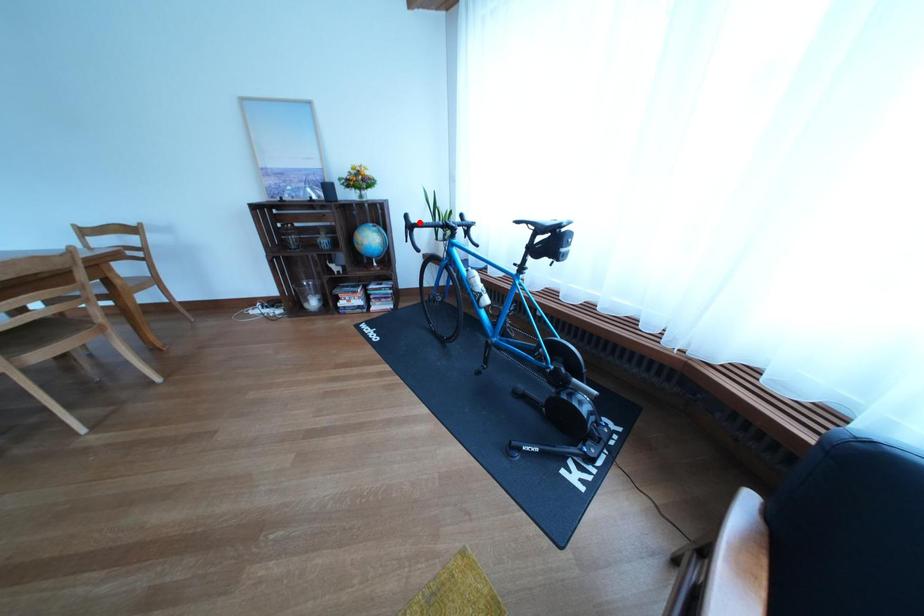
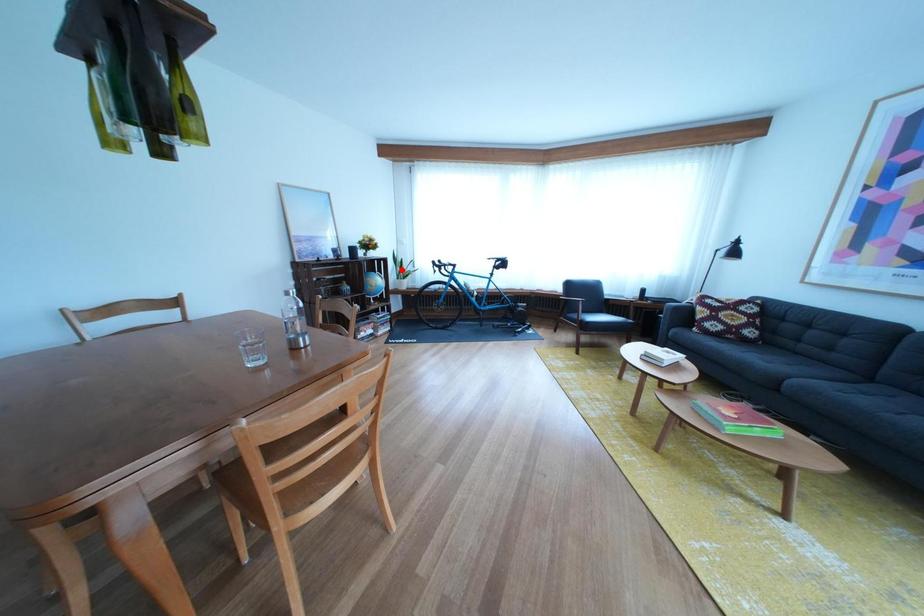
I am providing you with two images of the same scene from different viewpoints. A red point is marked on the first image and another point is marked on the second image. Is the marked point in image1 the same physical position as the marked point in image2?

No